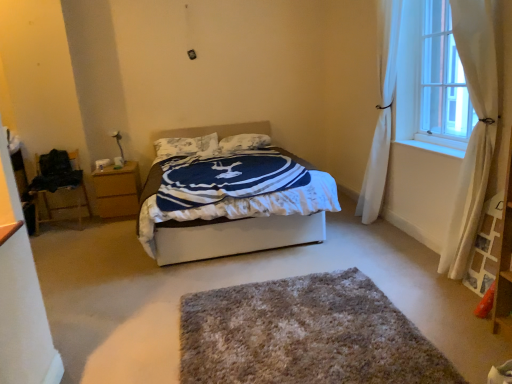
At what (x,y) coordinates should I click in order to perform the action: click on vacant region to the left of shaggy gray rug at center. Please return your answer as a coordinate pair (x, y). Image resolution: width=512 pixels, height=384 pixels. Looking at the image, I should click on (120, 320).